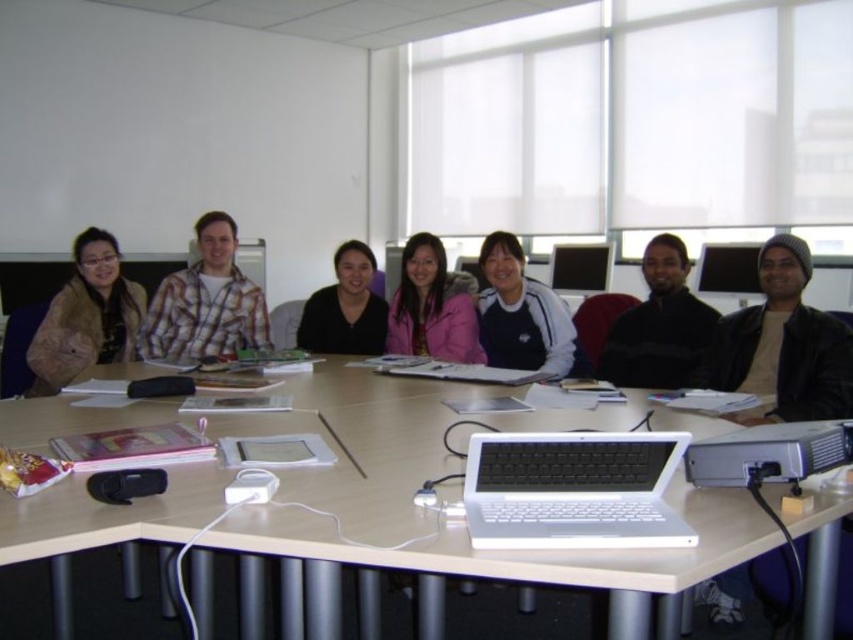
You are standing in the room and want to reach the point at coordinates (68, 371). The room has a standard door height of 2 meters. Can you walk to that point without bending down?

The point at coordinates (68, 371) is 2.94 meters away from the viewer. Since the distance is greater than the door height of 2 meters, you can walk to that point without bending down because the height of the door is irrelevant to the distance required to reach the point.

Consider the image. You are sitting at the conference table and want to unplug the silver metallic projector at lower right from the matte black monitor at upper right. Based on their positions, which device should you move closer to access the cable connection?

The silver metallic projector at lower right is in front of the matte black monitor at upper right, so you should move the silver metallic projector at lower right closer to access the cable connection.

You are standing at the front of the room facing the conference table. There are two points marked on the table. The first point is at coordinate point (833, 460) and the second point is at coordinate point (740, 288). If you want to place a small object on the table closer to you, which point should you choose?

You should choose point (833, 460) because it is closer to the camera and thus closer to your position at the front of the room.